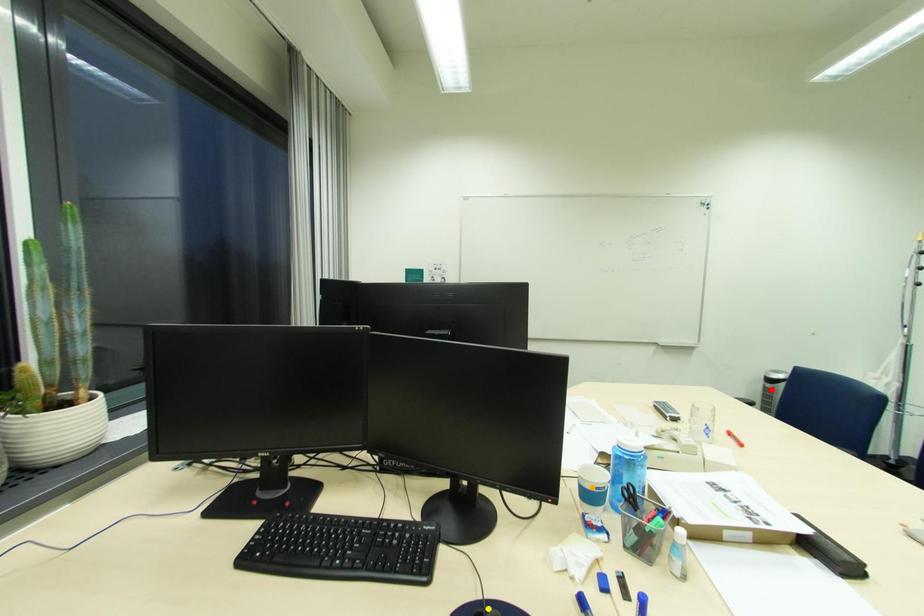
Order these from nearest to farthest:
1. red point
2. yellow point
3. orange point

red point < orange point < yellow point